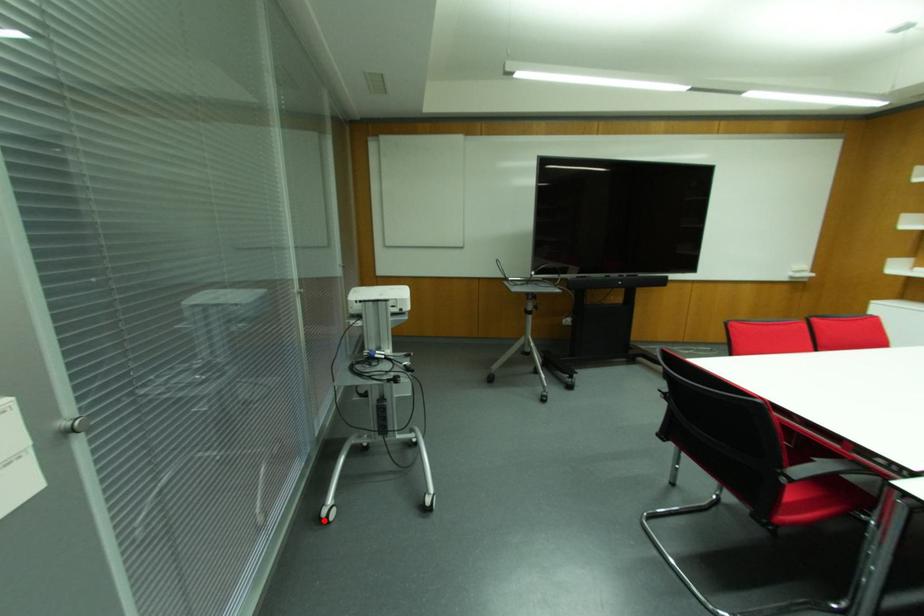
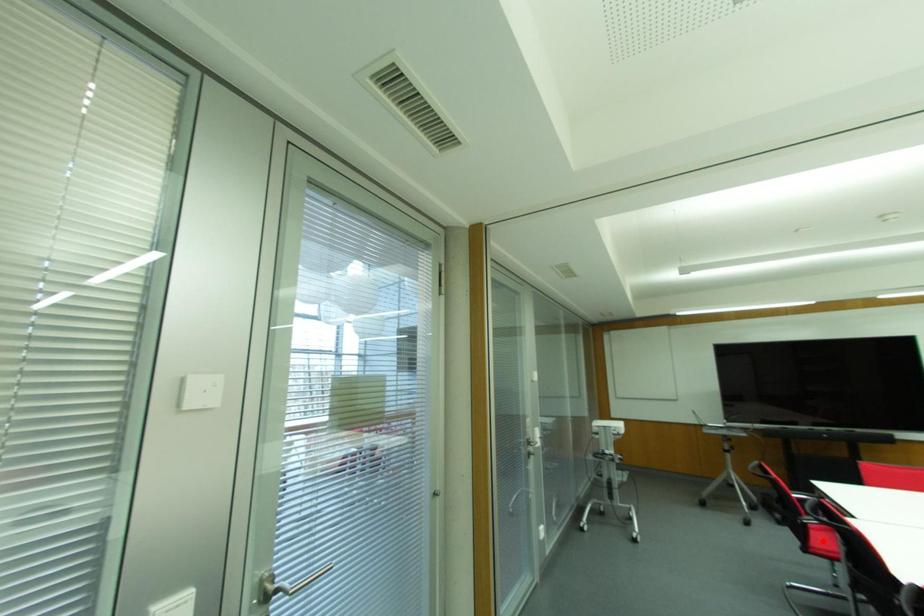
I am providing you with two images of the same scene from different viewpoints. A red point is marked on the first image and another point is marked on the second image. Do the highlighted points in image1 and image2 indicate the same real-world spot?

No